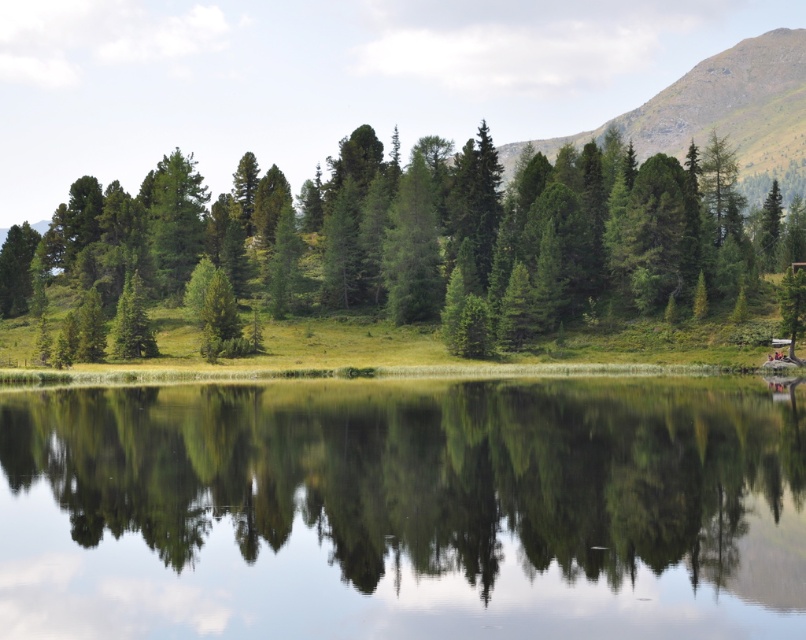
Can you confirm if clear water at center is smaller than green matte tree at center?

Indeed, clear water at center has a smaller size compared to green matte tree at center.

Can you confirm if clear water at center is positioned below green matte tree at center?

Indeed, clear water at center is positioned under green matte tree at center.

Measure the distance between clear water at center and camera.

clear water at center and camera are 17.98 meters apart.

This screenshot has width=806, height=640. I want to click on clear water at center, so click(x=404, y=509).

Can you confirm if clear water at center is positioned to the left of green grassy mountain at upper right?

Indeed, clear water at center is positioned on the left side of green grassy mountain at upper right.

Can you confirm if clear water at center is shorter than green grassy mountain at upper right?

Yes.

Is point (44, 589) behind point (767, 177)?

No, (44, 589) is closer to viewer.

At what (x,y) coordinates should I click in order to perform the action: click on clear water at center. Please return your answer as a coordinate pair (x, y). Looking at the image, I should click on (404, 509).

From the picture: Who is more forward, (651, 228) or (787, 195)?

Point (651, 228) is in front.

Who is more distant from viewer, (426, 211) or (686, 97)?

Positioned behind is point (686, 97).

Where is `green matte tree at center`? This screenshot has width=806, height=640. green matte tree at center is located at coordinates (416, 232).